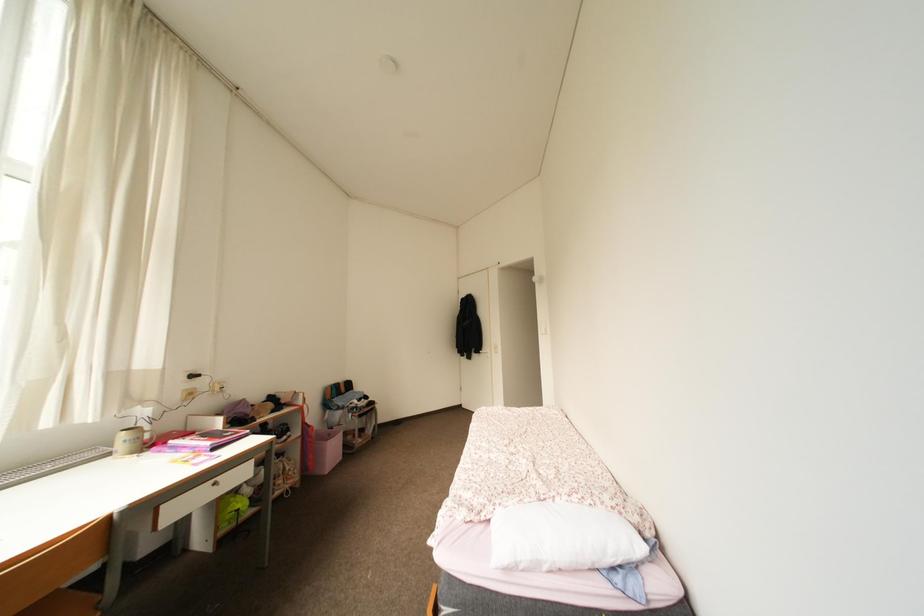
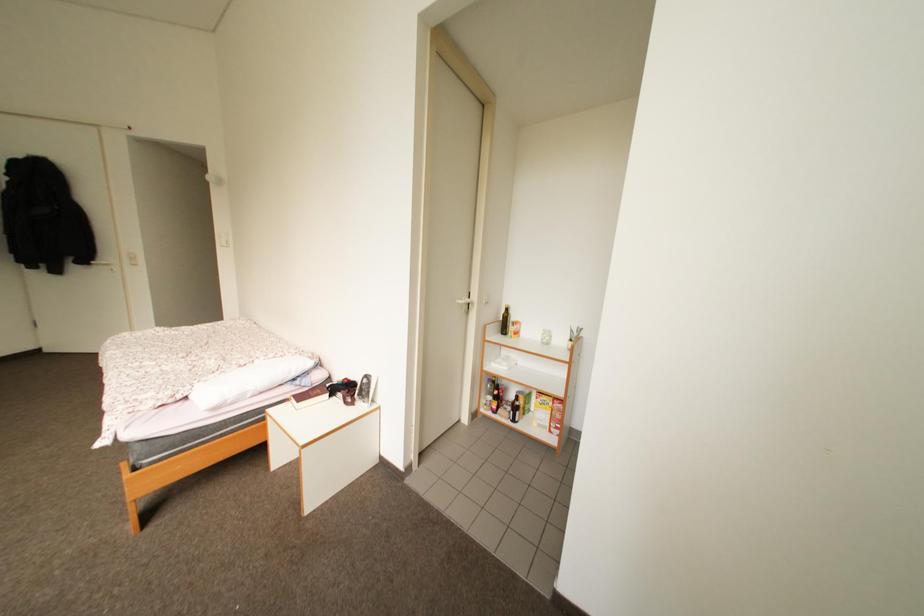
Question: Based on the continuous images, in which direction is the camera rotating? Reply with the corresponding letter.

Choices:
 (A) Left
 (B) Right
 (C) Up
 (D) Down

Answer: (B)